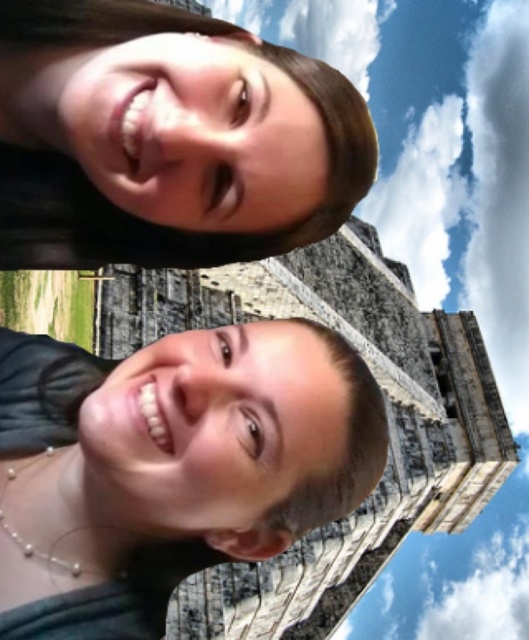
Is matte black hair at center behind brown hair at upper center?

No, it is not.

Who is shorter, matte black hair at center or brown hair at upper center?

brown hair at upper center

Does point (293, 360) come closer to viewer compared to point (50, 80)?

No, it is not.

I want to click on matte black hair at center, so click(169, 467).